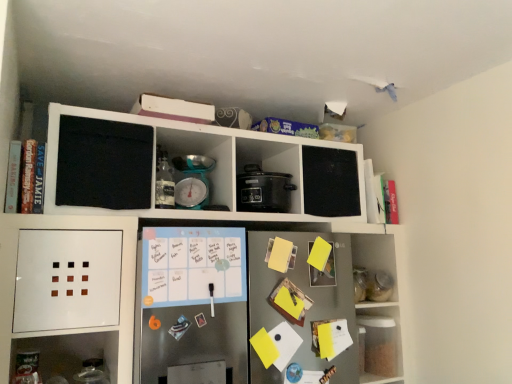
Question: From the image's perspective, would you say clear plastic container at lower right, marked as the 1th shelf in a right-to-left arrangement, is shown under teal plastic scale at center, the 2th appliance when ordered from right to left?

Choices:
 (A) no
 (B) yes

Answer: (B)

Question: Is clear plastic container at lower right, marked as the 1th shelf in a right-to-left arrangement, oriented away from teal plastic scale at center, which is counted as the 1th appliance, starting from the left?

Choices:
 (A) yes
 (B) no

Answer: (B)

Question: From a real-world perspective, is clear plastic container at lower right, the second shelf positioned from the left, positioned under teal plastic scale at center, which is counted as the 1th appliance, starting from the left, based on gravity?

Choices:
 (A) yes
 (B) no

Answer: (A)

Question: From a real-world perspective, is clear plastic container at lower right, marked as the 1th shelf in a right-to-left arrangement, on top of teal plastic scale at center, the 2th appliance when ordered from right to left?

Choices:
 (A) yes
 (B) no

Answer: (B)

Question: Is clear plastic container at lower right, marked as the 1th shelf in a right-to-left arrangement, positioned beyond the bounds of teal plastic scale at center, the 2th appliance when ordered from right to left?

Choices:
 (A) no
 (B) yes

Answer: (B)

Question: Does point (270, 188) appear closer or farther from the camera than point (202, 183)?

Choices:
 (A) farther
 (B) closer

Answer: (A)

Question: Is black matte slow cooker at center, the first appliance viewed from the right, in front of or behind teal plastic scale at center, the 2th appliance when ordered from right to left, in the image?

Choices:
 (A) front
 (B) behind

Answer: (B)

Question: In terms of size, does black matte slow cooker at center, the first appliance viewed from the right, appear bigger or smaller than teal plastic scale at center, the 2th appliance when ordered from right to left?

Choices:
 (A) big
 (B) small

Answer: (A)

Question: From a real-world perspective, is black matte slow cooker at center, the first appliance viewed from the right, physically located above or below teal plastic scale at center, the 2th appliance when ordered from right to left?

Choices:
 (A) below
 (B) above

Answer: (A)

Question: In terms of width, does teal plastic scale at center, which is counted as the 1th appliance, starting from the left, look wider or thinner when compared to white matte refrigerator at center, which is counted as the second shelf, starting from the right?

Choices:
 (A) wide
 (B) thin

Answer: (B)

Question: Based on their sizes in the image, would you say teal plastic scale at center, which is counted as the 1th appliance, starting from the left, is bigger or smaller than white matte refrigerator at center, which is counted as the second shelf, starting from the right?

Choices:
 (A) big
 (B) small

Answer: (B)

Question: In the image, is teal plastic scale at center, which is counted as the 1th appliance, starting from the left, on the left side or the right side of white matte refrigerator at center, which is counted as the second shelf, starting from the right?

Choices:
 (A) left
 (B) right

Answer: (A)

Question: Is teal plastic scale at center, the 2th appliance when ordered from right to left, taller or shorter than white matte refrigerator at center, the 1th shelf in the left-to-right sequence?

Choices:
 (A) short
 (B) tall

Answer: (A)

Question: Is point (293, 296) positioned closer to the camera than point (356, 319)?

Choices:
 (A) closer
 (B) farther

Answer: (A)

Question: Is yellow paper at center, the second book from the right, taller or shorter than clear plastic container at lower right, marked as the 1th shelf in a right-to-left arrangement?

Choices:
 (A) tall
 (B) short

Answer: (B)